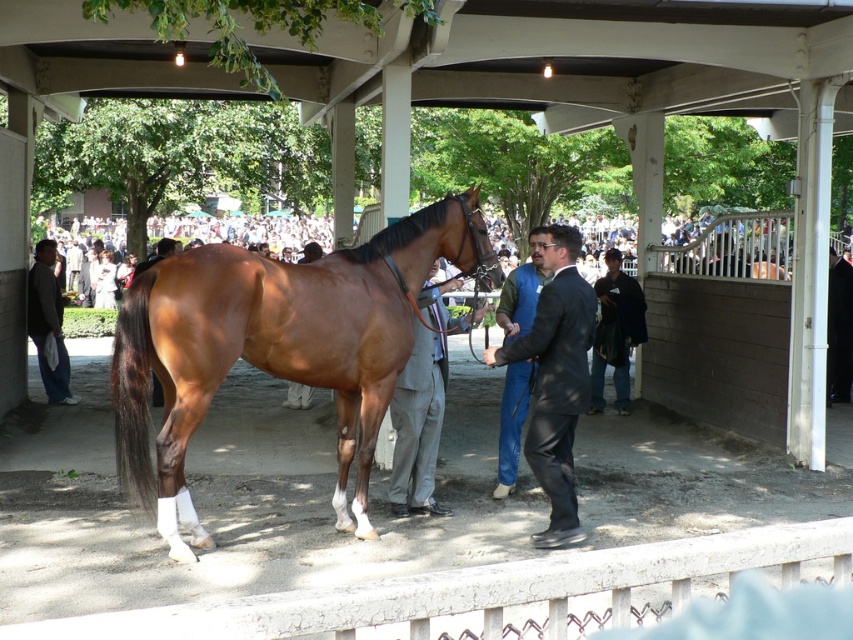
You are a photographer positioned at the back of the scene. You need to take a photo of the blue jeans at center and the dark gray suit at left. Based on their positions, which one is closer to the ground?

The blue jeans at center is located below dark gray suit at left, so the blue jeans at center is closer to the ground.

Based on the photo, you are standing at the point labeled point [49,240] and want to walk towards the camera. Which direction should you move to get closer to the camera without moving past point [575,237]?

You should move towards point [575,237] because it is closer to the camera than point [49,240]. Moving towards point [575,237] will bring you closer to the camera without passing it.